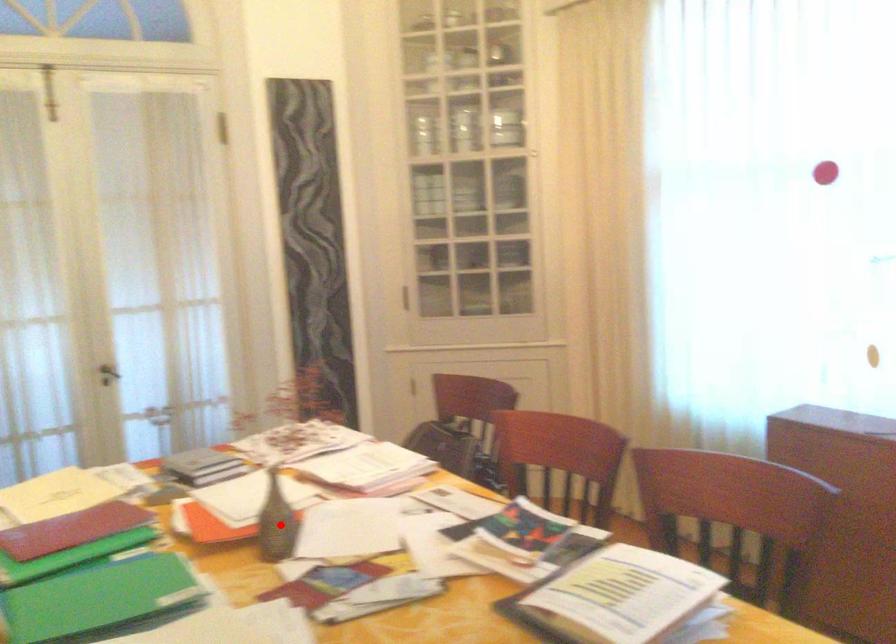
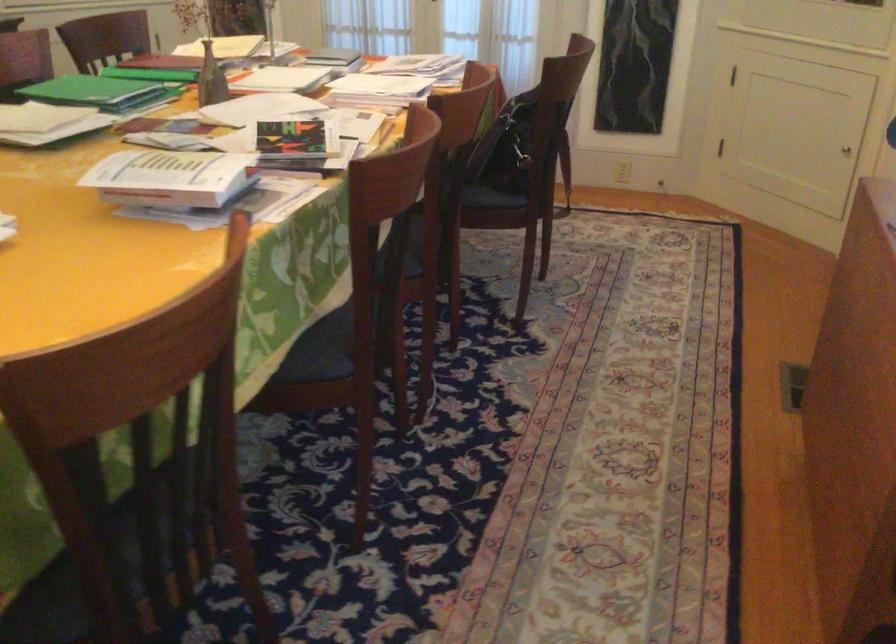
Question: I am providing you with two images of the same scene from different viewpoints. Image1 has a red point marked. In image2, the corresponding 3D location appears at what relative position? Reply with the corresponding letter.

Choices:
 (A) Closer
 (B) Farther

Answer: (B)